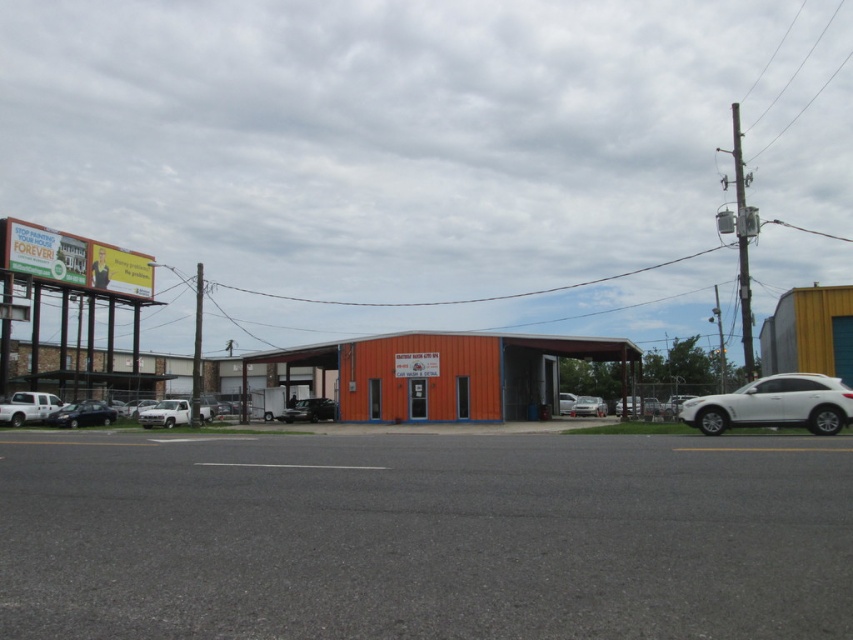
Based on the scene description, where is the white matte van at lower left located in terms of coordinates?

The white matte van at lower left is located at coordinates (27, 406).

You are a delivery driver who needs to park your truck between the white matte van at lower left and the shiny black sedan at lower left. Is there enough space between them for your truck?

The white matte van at lower left is to the left of the shiny black sedan at lower left, but the distance between them is not specified. Without knowing the exact space, it is impossible to determine if your truck can fit between them.